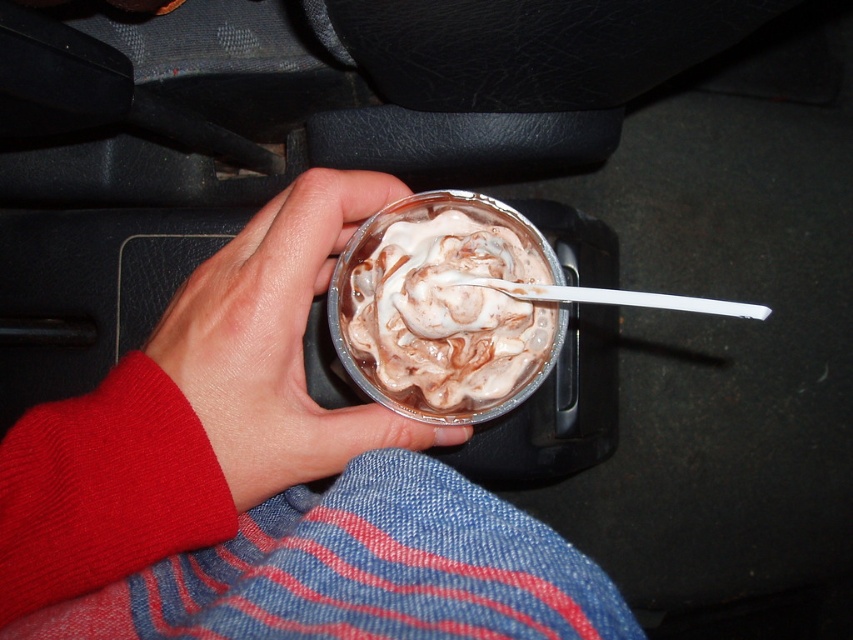
Image resolution: width=853 pixels, height=640 pixels. Describe the element at coordinates (277, 342) in the screenshot. I see `smooth skin hand at center` at that location.

What are the coordinates of `smooth skin hand at center` in the screenshot? It's located at (277, 342).

Where is `smooth skin hand at center`? The width and height of the screenshot is (853, 640). smooth skin hand at center is located at coordinates (277, 342).